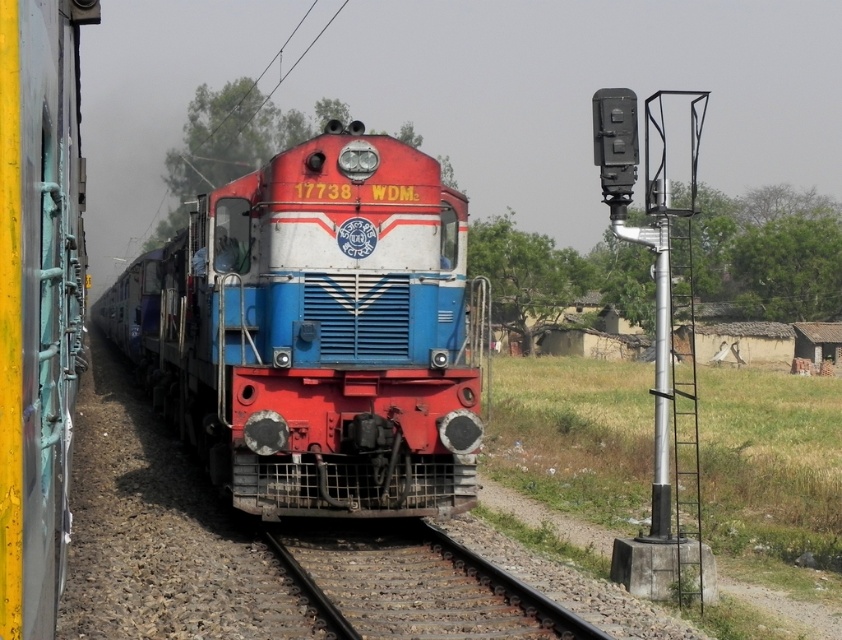
Question: Can you confirm if shiny red locomotive at center is positioned to the right of rusty metal train track at center?

Choices:
 (A) no
 (B) yes

Answer: (A)

Question: Which point is farther to the camera?

Choices:
 (A) (413, 435)
 (B) (544, 600)

Answer: (A)

Question: Can you confirm if shiny red locomotive at center is thinner than rusty metal train track at center?

Choices:
 (A) no
 (B) yes

Answer: (A)

Question: In this image, where is shiny red locomotive at center located relative to rusty metal train track at center?

Choices:
 (A) right
 (B) left

Answer: (B)